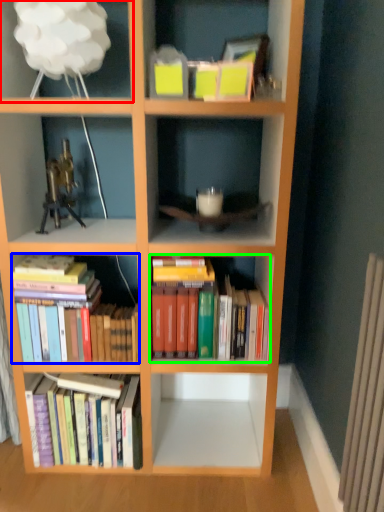
Question: Based on their relative distances, which object is nearer to shelf (highlighted by a red box)? Choose from book (highlighted by a blue box) and book (highlighted by a green box).

Choices:
 (A) book
 (B) book

Answer: (A)